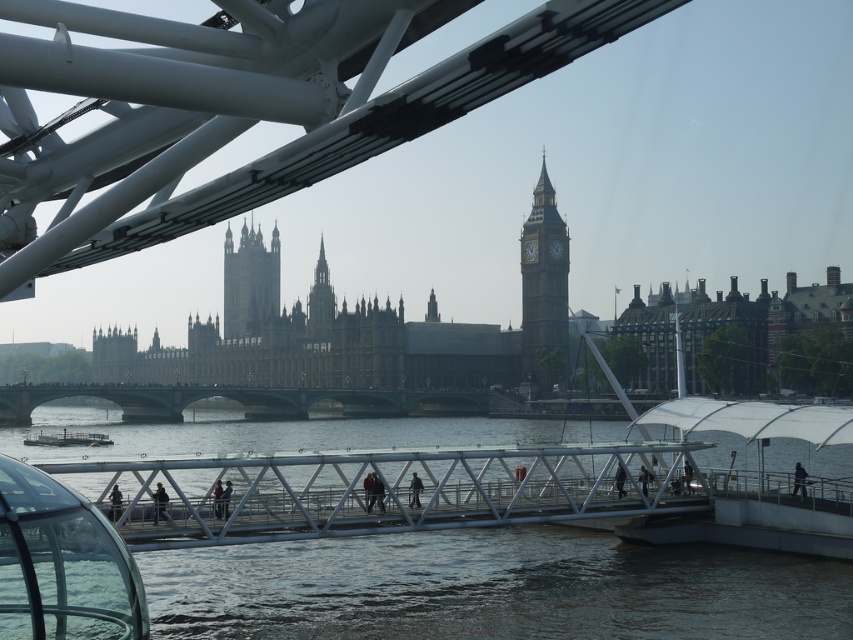
What is the object located at the coordinates point (543, 289) in the image?

The golden stone clock tower at center is located at point (543, 289).

You are a tourist standing on the green metallic bridge at center and want to take a photo of the Elizabeth Tower. Based on your current position, can you see the Elizabeth Tower clearly? Please explain why or why not.

The green metallic bridge at center is positioned at coordinates point (238, 401). Since the Elizabeth Tower is part of the Palace of Westminster with Gothic Revival architecture in the background, and the bridge is centrally located over the Thames, the tourist would have an unobstructed view of the Elizabeth Tower from this vantage point.

You are a tourist standing on the modern glass dome structure in the foreground of the scene. You want to cross the river using the green metallic bridge at center. Based on the coordinates provided, is the bridge directly in front of you or to one side?

The green metallic bridge at center is located at coordinates point (x=238, y=401), which places it to the right side relative to your position on the modern glass dome structure. Therefore, you would need to move towards the right to reach the bridge.